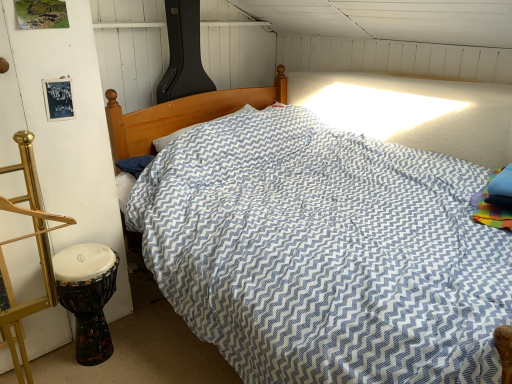
This screenshot has width=512, height=384. What do you see at coordinates (89, 298) in the screenshot?
I see `decorative painted drum at left` at bounding box center [89, 298].

Identify the location of decorative painted drum at left. (89, 298).

What is the approximate height of decorative painted drum at left?

18.42 inches.

You are a GUI agent. You are given a task and a screenshot of the screen. Output one action in this format:
    pyautogui.click(x=<x>, y=<y>)
    Task: Click on the decorative painted drum at left
    
    Given the screenshot: What is the action you would take?
    click(89, 298)